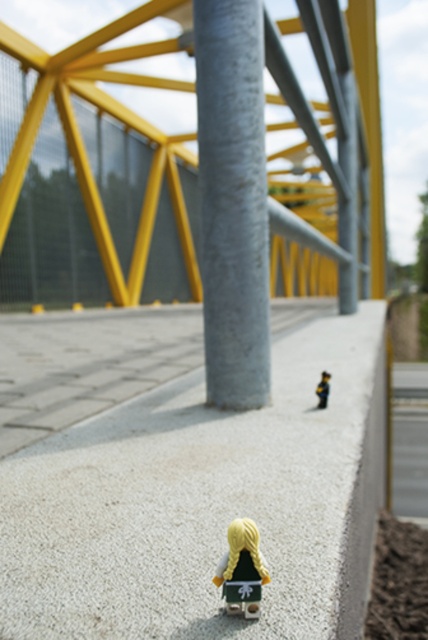
Question: Which point is farther from the camera taking this photo?

Choices:
 (A) (324, 376)
 (B) (210, 216)

Answer: (B)

Question: Is gray metallic pole at center bigger than matte yellow hair at lower center?

Choices:
 (A) yes
 (B) no

Answer: (A)

Question: Can you confirm if gray metallic pole at center is positioned to the left of gray concrete curb at right?

Choices:
 (A) no
 (B) yes

Answer: (B)

Question: Can you confirm if gray metallic pole at center is positioned to the right of matte yellow hair at lower center?

Choices:
 (A) no
 (B) yes

Answer: (B)

Question: Which object appears farthest from the camera in this image?

Choices:
 (A) gray metallic pole at center
 (B) gray concrete curb at right
 (C) white textured concrete at center
 (D) yellow matte toy at upper right

Answer: (D)

Question: Which point appears closest to the camera in this image?

Choices:
 (A) (202, 99)
 (B) (223, 557)

Answer: (B)